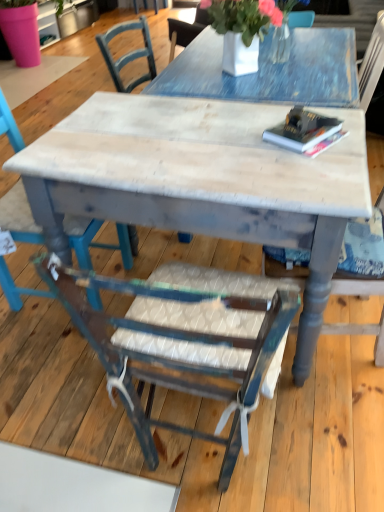
Question: Would you say distressed wood chair at lower left, which appears as the 1th chair when viewed from the left, is to the left or to the right of wooden chair at right, arranged as the first chair when viewed from the right, in the picture?

Choices:
 (A) right
 (B) left

Answer: (B)

Question: Which is correct: distressed wood chair at lower left, which appears as the 1th chair when viewed from the left, is inside wooden chair at right, which is counted as the third chair, starting from the left, or outside of it?

Choices:
 (A) inside
 (B) outside

Answer: (B)

Question: Which of these objects is positioned closest to the distressed wood table at center?

Choices:
 (A) wooden chair at right, which is counted as the third chair, starting from the left
 (B) hardcover book at upper right
 (C) distressed wood chair at lower left, which is counted as the third chair, starting from the right
 (D) wooden chair with woven seat at center, which is the 2th chair in left-to-right order

Answer: (B)

Question: Which of these objects is positioned farthest from the distressed wood table at center?

Choices:
 (A) wooden chair at right, which is counted as the third chair, starting from the left
 (B) hardcover book at upper right
 (C) wooden chair with woven seat at center, which is the 2th chair in right-to-left order
 (D) distressed wood chair at lower left, which is counted as the third chair, starting from the right

Answer: (D)